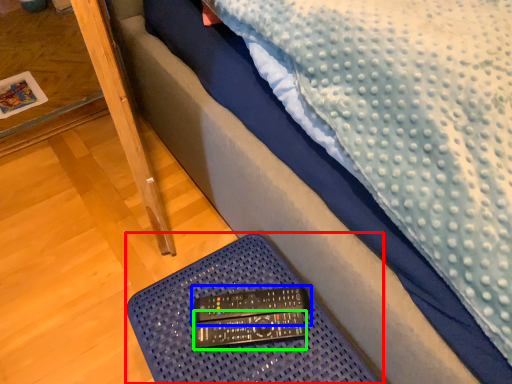
Question: Which object is positioned farthest from furniture (highlighted by a red box)? Select from control (highlighted by a blue box) and control (highlighted by a green box).

Choices:
 (A) control
 (B) control

Answer: (B)